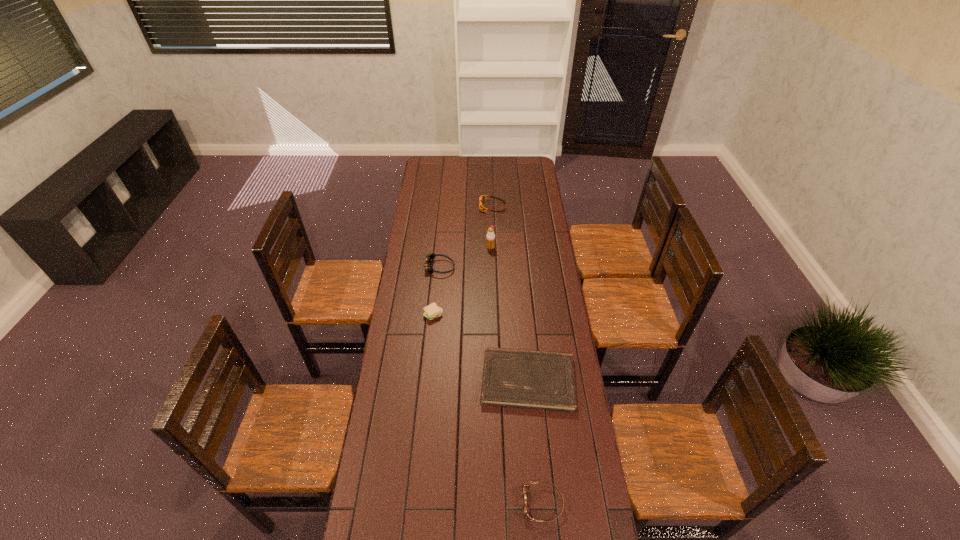
At what (x,y) coordinates should I click in order to perform the action: click on vacant space that satisfies the following two spatial constraints: 1. with the lenses facing forward on the farthest goggles; 2. on the back side of the paperback book. Please return your answer as a coordinate pair (x, y). Looking at the image, I should click on (498, 380).

Locate an element on the screen. This screenshot has width=960, height=540. vacant space that satisfies the following two spatial constraints: 1. at the front with a straw on the paperback book; 2. on the right side of the tallest object is located at coordinates (493, 380).